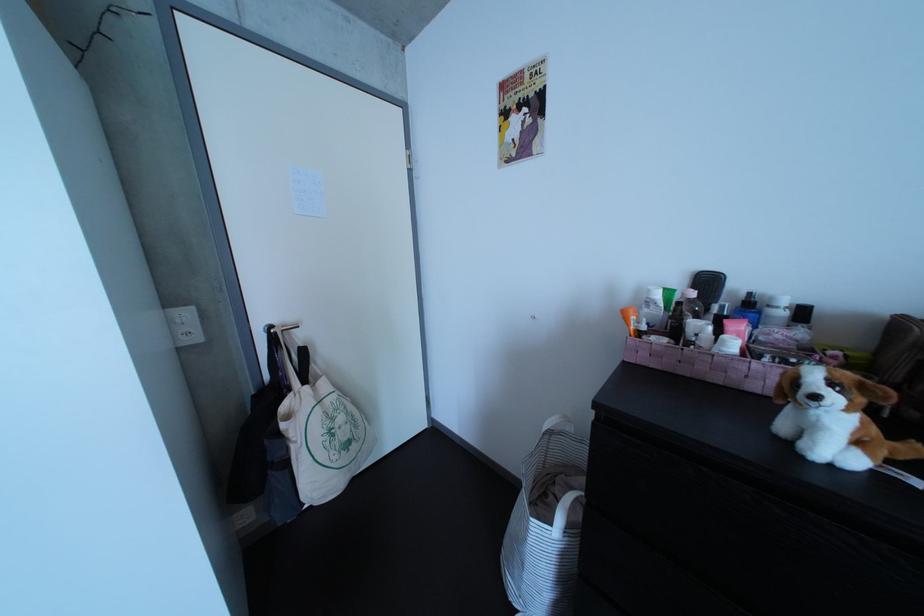
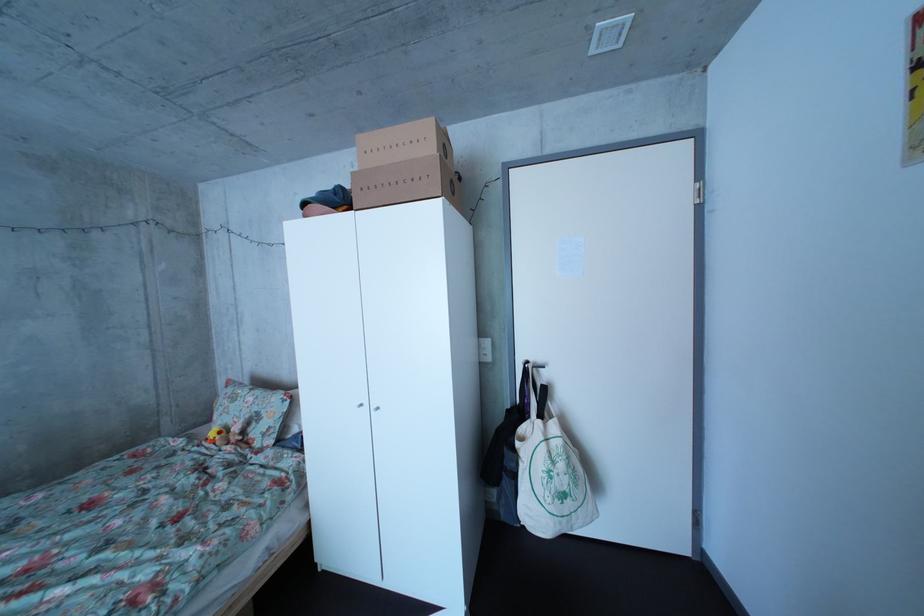
Question: The images are taken continuously from a first-person perspective. In which direction is your viewpoint rotating?

Choices:
 (A) Left
 (B) Right
 (C) Up
 (D) Down

Answer: (A)